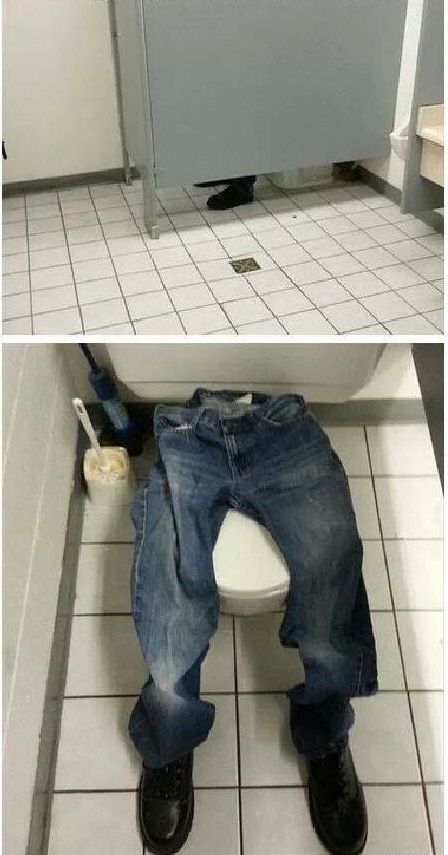
Show me all visible what you use to scrub a toilet in the image. Your answer should be formatted as a list of tuples, i.e. [(x1, y1), (x2, y2), ...], where each tuple contains the x and y coordinates of a point satisfying the conditions above.

[(106, 469)]